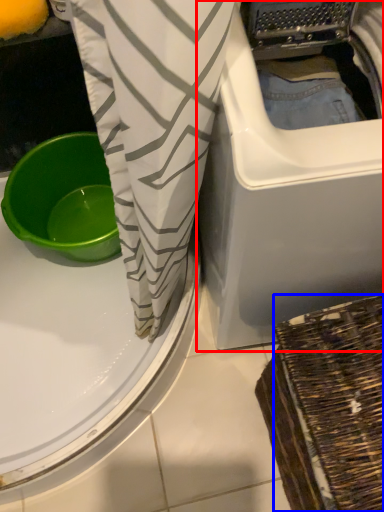
Question: Among these objects, which one is nearest to the camera, washing machine (highlighted by a red box) or basket (highlighted by a blue box)?

Choices:
 (A) washing machine
 (B) basket

Answer: (A)